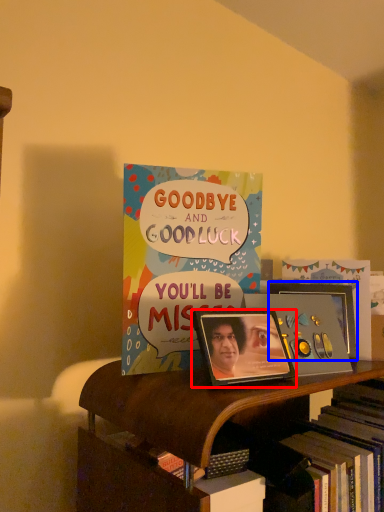
Question: Which of the following is the farthest to the observer, picture frame (highlighted by a red box) or picture frame (highlighted by a blue box)?

Choices:
 (A) picture frame
 (B) picture frame

Answer: (B)